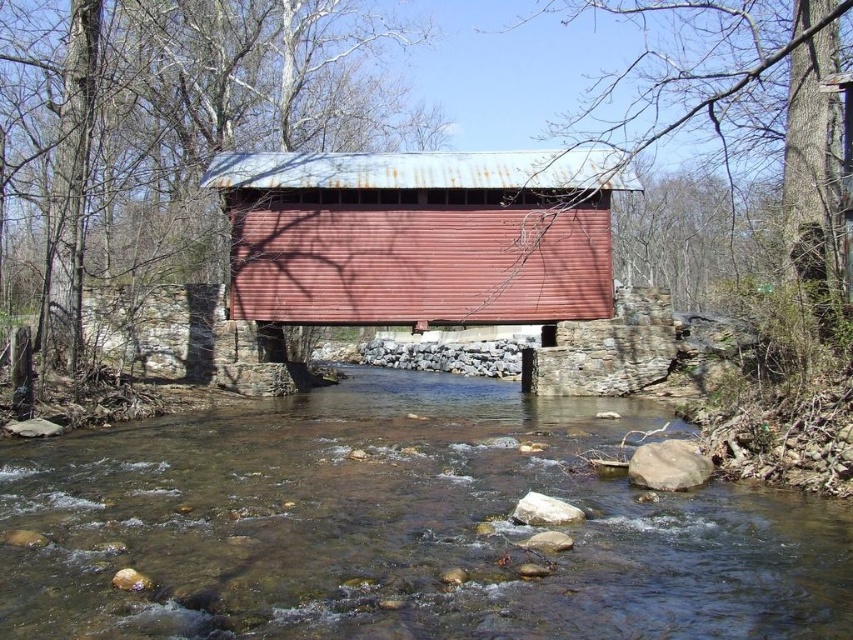
Which is behind, point (279, 429) or point (491, 188)?

Positioned behind is point (491, 188).

What do you see at coordinates (398, 528) in the screenshot? Image resolution: width=853 pixels, height=640 pixels. I see `clear water at center` at bounding box center [398, 528].

Between point (747, 634) and point (509, 225), which one is positioned in front?

Point (747, 634) is in front.

The width and height of the screenshot is (853, 640). Identify the location of clear water at center. (398, 528).